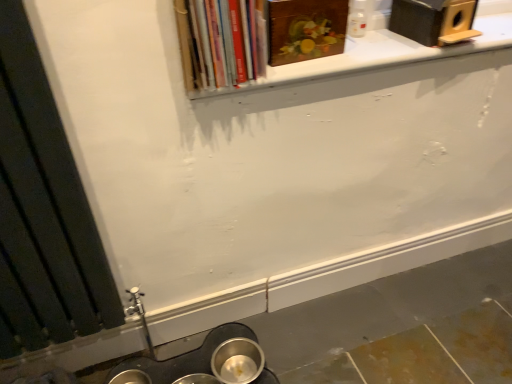
In order to face hardcover books at upper center, which is counted as the 1th book, starting from the left, should I rotate leftwards or rightwards?

A 4.585 degree turn to the left will do.

The image size is (512, 384). What are the coordinates of `black matte radiator at left` in the screenshot? It's located at (42, 211).

What do you see at coordinates (394, 49) in the screenshot?
I see `white matte window sill at upper center` at bounding box center [394, 49].

You are a GUI agent. You are given a task and a screenshot of the screen. Output one action in this format:
    pyautogui.click(x=<x>, y=<y>)
    Task: Click on the wooden painting at upper center, the 2th book viewed from the left
    The height and width of the screenshot is (384, 512).
    Given the screenshot: What is the action you would take?
    pyautogui.click(x=305, y=29)

I want to click on hardcover books at upper center, which appears as the second book when viewed from the right, so click(222, 43).

From the image's perspective, would you say black matte radiator at left is shown under wooden painting at upper center, which is the 1th book from right to left?

Yes, from the image's perspective, black matte radiator at left is below wooden painting at upper center, which is the 1th book from right to left.

Considering their positions, is black matte radiator at left located in front of or behind wooden painting at upper center, which is the 1th book from right to left?

In the image, black matte radiator at left appears in front of wooden painting at upper center, which is the 1th book from right to left.

You are a GUI agent. You are given a task and a screenshot of the screen. Output one action in this format:
    pyautogui.click(x=<x>, y=<y>)
    Task: Click on the window frame that is below the wooden painting at upper center, the 2th book viewed from the left (from the image's perspective)
    
    Given the screenshot: What is the action you would take?
    pyautogui.click(x=42, y=211)

From a real-world perspective, who is located higher, black matte radiator at left or wooden painting at upper center, the 2th book viewed from the left?

wooden painting at upper center, the 2th book viewed from the left, from a real-world perspective.

Is white matte window sill at upper center behind hardcover books at upper center, which appears as the second book when viewed from the right?

Yes, the depth of white matte window sill at upper center is greater than that of hardcover books at upper center, which appears as the second book when viewed from the right.

Considering the relative sizes of white matte window sill at upper center and hardcover books at upper center, which appears as the second book when viewed from the right, in the image provided, is white matte window sill at upper center shorter than hardcover books at upper center, which appears as the second book when viewed from the right,?

Yes, white matte window sill at upper center is shorter than hardcover books at upper center, which appears as the second book when viewed from the right.

Can you tell me how much white matte window sill at upper center and hardcover books at upper center, which is counted as the 1th book, starting from the left, differ in facing direction?

They differ by 0.202 degrees in their facing directions.

Image resolution: width=512 pixels, height=384 pixels. I want to click on window sill on the right side of hardcover books at upper center, which is counted as the 1th book, starting from the left, so click(394, 49).

Between wooden painting at upper center, the 2th book viewed from the left, and white matte window sill at upper center, which one is positioned in front?

white matte window sill at upper center is closer to the camera.

From the image's perspective, which one is positioned lower, wooden painting at upper center, which is the 1th book from right to left, or white matte window sill at upper center?

white matte window sill at upper center appears lower in the image.

Consider the image. Are wooden painting at upper center, the 2th book viewed from the left, and white matte window sill at upper center far apart?

No, wooden painting at upper center, the 2th book viewed from the left, is not far from white matte window sill at upper center.

Can you confirm if wooden painting at upper center, the 2th book viewed from the left, is bigger than white matte window sill at upper center?

No.

Considering the sizes of objects hardcover books at upper center, which is counted as the 1th book, starting from the left, and black matte radiator at left in the image provided, who is smaller, hardcover books at upper center, which is counted as the 1th book, starting from the left, or black matte radiator at left?

With smaller size is hardcover books at upper center, which is counted as the 1th book, starting from the left.

From the image's perspective, is hardcover books at upper center, which is counted as the 1th book, starting from the left, positioned above or below black matte radiator at left?

Clearly, from the image's perspective, hardcover books at upper center, which is counted as the 1th book, starting from the left, is above black matte radiator at left.

Is hardcover books at upper center, which is counted as the 1th book, starting from the left, not close to black matte radiator at left?

No, there isn't a large distance between hardcover books at upper center, which is counted as the 1th book, starting from the left, and black matte radiator at left.

Is hardcover books at upper center, which is counted as the 1th book, starting from the left, spatially inside black matte radiator at left, or outside of it?

hardcover books at upper center, which is counted as the 1th book, starting from the left, is spatially situated outside black matte radiator at left.

Can you confirm if wooden painting at upper center, which is the 1th book from right to left, is thinner than hardcover books at upper center, which is counted as the 1th book, starting from the left?

Yes, wooden painting at upper center, which is the 1th book from right to left, is thinner than hardcover books at upper center, which is counted as the 1th book, starting from the left.

Is point (278, 17) positioned behind point (189, 8)?

Yes.

Considering the sizes of objects wooden painting at upper center, the 2th book viewed from the left, and hardcover books at upper center, which appears as the second book when viewed from the right, in the image provided, who is smaller, wooden painting at upper center, the 2th book viewed from the left, or hardcover books at upper center, which appears as the second book when viewed from the right,?

With smaller size is wooden painting at upper center, the 2th book viewed from the left.

From the picture: Between white matte window sill at upper center and wooden painting at upper center, the 2th book viewed from the left, which one has more height?

Standing taller between the two is wooden painting at upper center, the 2th book viewed from the left.

Locate an element on the screen. The height and width of the screenshot is (384, 512). book behind the white matte window sill at upper center is located at coordinates 305,29.

Is white matte window sill at upper center wider than wooden painting at upper center, which is the 1th book from right to left?

Yes, white matte window sill at upper center is wider than wooden painting at upper center, which is the 1th book from right to left.

Would you say white matte window sill at upper center is a long distance from wooden painting at upper center, the 2th book viewed from the left?

white matte window sill at upper center is near wooden painting at upper center, the 2th book viewed from the left, not far away.

Between black matte radiator at left and hardcover books at upper center, which appears as the second book when viewed from the right, which one has smaller size?

hardcover books at upper center, which appears as the second book when viewed from the right, is smaller.

Which of these two, black matte radiator at left or hardcover books at upper center, which appears as the second book when viewed from the right, stands taller?

Standing taller between the two is black matte radiator at left.

From the image's perspective, does black matte radiator at left appear lower than hardcover books at upper center, which is counted as the 1th book, starting from the left?

Indeed, from the image's perspective, black matte radiator at left is shown beneath hardcover books at upper center, which is counted as the 1th book, starting from the left.

Is black matte radiator at left wider or thinner than hardcover books at upper center, which appears as the second book when viewed from the right?

black matte radiator at left is thinner than hardcover books at upper center, which appears as the second book when viewed from the right.

Starting from the black matte radiator at left, which book is the 2nd one behind? Please provide its 2D coordinates.

[(305, 29)]

Starting from the white matte window sill at upper center, which book is the 2nd one to the left? Please provide its 2D coordinates.

[(222, 43)]

Estimate the real-world distances between objects in this image. Which object is further from black matte radiator at left, wooden painting at upper center, the 2th book viewed from the left, or hardcover books at upper center, which appears as the second book when viewed from the right?

wooden painting at upper center, the 2th book viewed from the left.

When comparing their distances from black matte radiator at left, does hardcover books at upper center, which is counted as the 1th book, starting from the left, or wooden painting at upper center, the 2th book viewed from the left, seem further?

wooden painting at upper center, the 2th book viewed from the left.

Looking at the image, which one is located further to white matte window sill at upper center, black matte radiator at left or wooden painting at upper center, the 2th book viewed from the left?

black matte radiator at left lies further to white matte window sill at upper center than the other object.

When comparing their distances from hardcover books at upper center, which is counted as the 1th book, starting from the left, does wooden painting at upper center, which is the 1th book from right to left, or white matte window sill at upper center seem further?

white matte window sill at upper center.

Looking at the image, which one is located further to hardcover books at upper center, which appears as the second book when viewed from the right, wooden painting at upper center, which is the 1th book from right to left, or black matte radiator at left?

black matte radiator at left is positioned further to the anchor hardcover books at upper center, which appears as the second book when viewed from the right.

Looking at the image, which one is located further to wooden painting at upper center, which is the 1th book from right to left, hardcover books at upper center, which appears as the second book when viewed from the right, or black matte radiator at left?

Based on the image, black matte radiator at left appears to be further to wooden painting at upper center, which is the 1th book from right to left.

Estimate the real-world distances between objects in this image. Which object is closer to wooden painting at upper center, the 2th book viewed from the left, black matte radiator at left or hardcover books at upper center, which is counted as the 1th book, starting from the left?

Based on the image, hardcover books at upper center, which is counted as the 1th book, starting from the left, appears to be nearer to wooden painting at upper center, the 2th book viewed from the left.

Which object lies nearer to the anchor point hardcover books at upper center, which is counted as the 1th book, starting from the left, black matte radiator at left or white matte window sill at upper center?

Based on the image, white matte window sill at upper center appears to be nearer to hardcover books at upper center, which is counted as the 1th book, starting from the left.

Where is `book situated between black matte radiator at left and wooden painting at upper center, which is the 1th book from right to left, from left to right`? book situated between black matte radiator at left and wooden painting at upper center, which is the 1th book from right to left, from left to right is located at coordinates (222, 43).

Find the location of `book between hardcover books at upper center, which is counted as the 1th book, starting from the left, and white matte window sill at upper center`. book between hardcover books at upper center, which is counted as the 1th book, starting from the left, and white matte window sill at upper center is located at coordinates (305, 29).